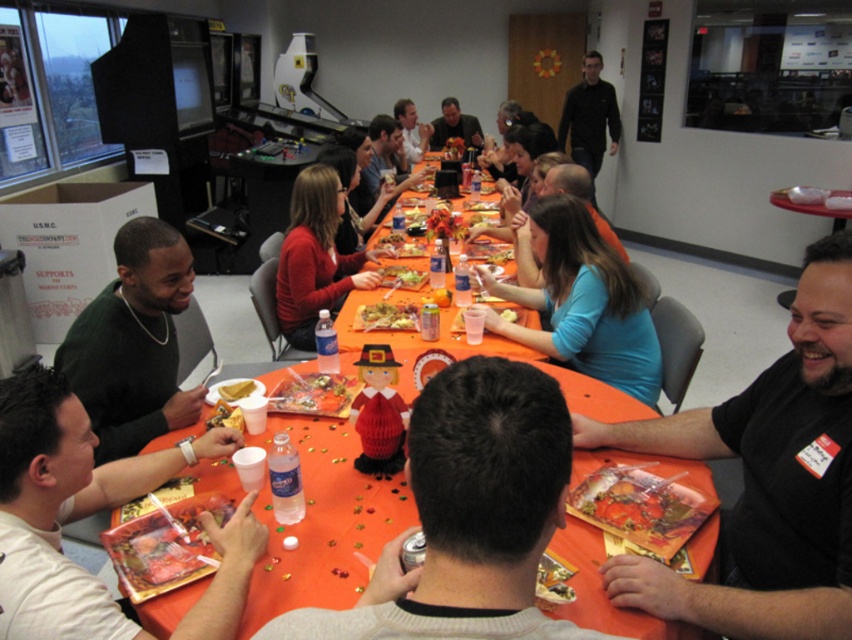
Can you confirm if blue cotton shirt at center is shorter than golden paper bag at center?

In fact, blue cotton shirt at center may be taller than golden paper bag at center.

Is blue cotton shirt at center smaller than golden paper bag at center?

No, blue cotton shirt at center is not smaller than golden paper bag at center.

Who is more distant from viewer, (x=540, y=259) or (x=226, y=381)?

Positioned behind is point (x=540, y=259).

Find the location of `blue cotton shirt at center`. blue cotton shirt at center is located at coordinates (583, 301).

This screenshot has width=852, height=640. I want to click on orange matte plastic cup at center, so click(x=507, y=314).

Is orange matte plastic cup at center thinner than smooth plastic cup at center?

Incorrect, orange matte plastic cup at center's width is not less than smooth plastic cup at center's.

Is point (501, 310) behind point (501, 317)?

Yes, it is.

Locate an element on the screen. The height and width of the screenshot is (640, 852). orange matte plastic cup at center is located at coordinates (507, 314).

Which is more to the right, orange paper plate at upper right or matte orange plate at center?

Positioned to the right is orange paper plate at upper right.

Measure the distance between orange paper plate at upper right and matte orange plate at center.

orange paper plate at upper right and matte orange plate at center are 8.88 feet apart.

Is point (838, 221) more distant than point (396, 236)?

Yes, point (838, 221) is farther from viewer.

The image size is (852, 640). In order to click on orange paper plate at upper right in this screenshot , I will do `click(809, 209)`.